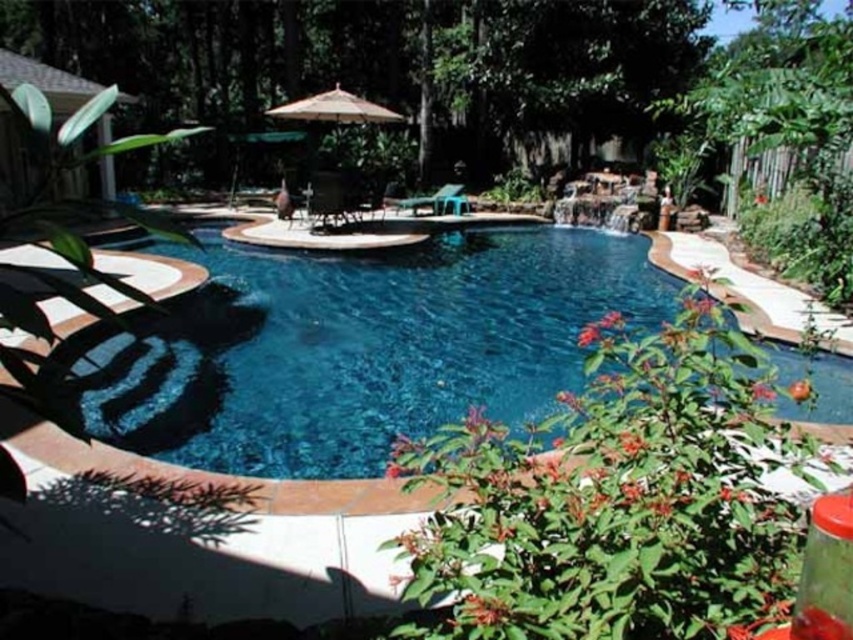
Question: Does beige fabric umbrella at center have a greater width compared to black plastic chair at center?

Choices:
 (A) no
 (B) yes

Answer: (B)

Question: Based on their relative distances, which object is farther from the black plastic chair at center?

Choices:
 (A) clear blue water at center
 (B) beige fabric umbrella at center

Answer: (A)

Question: Which object is positioned farthest from the beige fabric umbrella at center?

Choices:
 (A) metallic green chair at center
 (B) black plastic chair at center

Answer: (A)

Question: Which object is farther from the camera taking this photo?

Choices:
 (A) clear blue water at center
 (B) beige fabric umbrella at center

Answer: (B)

Question: Is clear blue water at center smaller than beige fabric umbrella at center?

Choices:
 (A) yes
 (B) no

Answer: (A)

Question: Is beige fabric umbrella at center below black plastic chair at center?

Choices:
 (A) no
 (B) yes

Answer: (A)